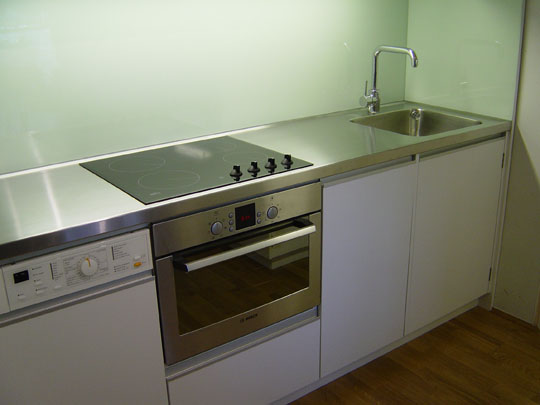
This screenshot has height=405, width=540. I want to click on led screen of the oven, so click(245, 224).